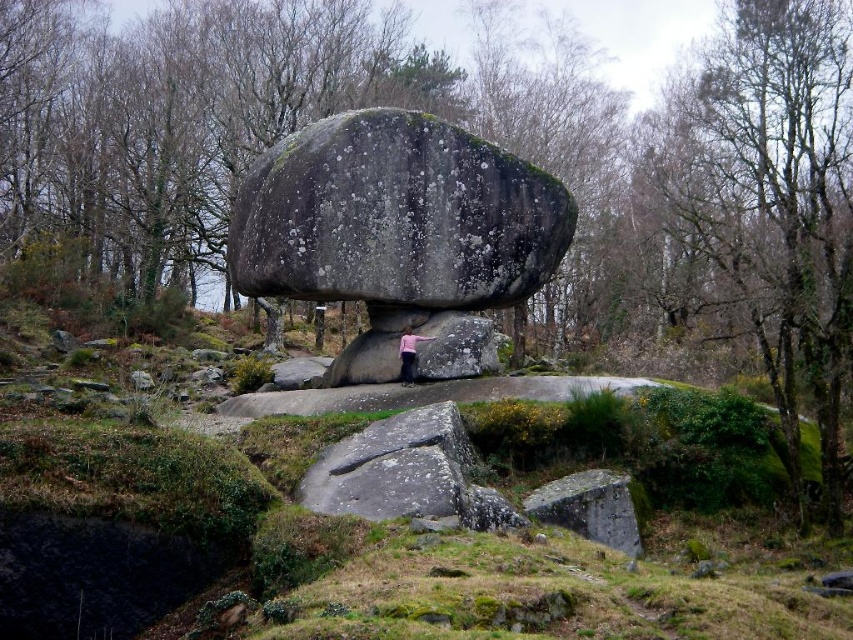
Question: Is green mossy rock at center further to camera compared to pink fabric at center?

Choices:
 (A) yes
 (B) no

Answer: (B)

Question: Can you confirm if green mossy rock at center is positioned to the left of gray rough rock at center?

Choices:
 (A) yes
 (B) no

Answer: (A)

Question: Which is nearer to the green mossy rock at center?

Choices:
 (A) gray rough rock at center
 (B) pink fabric at center

Answer: (A)

Question: Can you confirm if gray rough rock at center is wider than pink fabric at center?

Choices:
 (A) yes
 (B) no

Answer: (A)

Question: Which of these objects is positioned closest to the pink fabric at center?

Choices:
 (A) green mossy rock at center
 (B) gray rough rock at center

Answer: (B)

Question: Which point is closer to the camera taking this photo?

Choices:
 (A) (405, 374)
 (B) (70, 504)

Answer: (B)